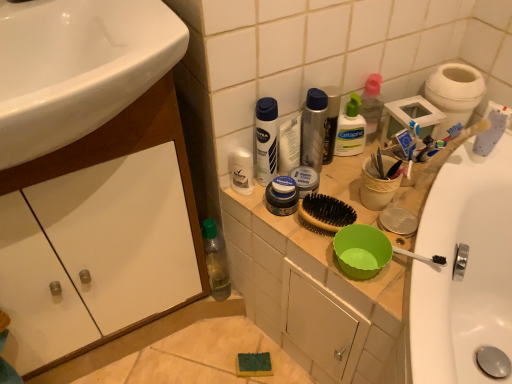
Describe the element at coordinates (314, 295) in the screenshot. This screenshot has width=512, height=384. I see `matte plastic toiletries at upper right` at that location.

This screenshot has height=384, width=512. Describe the element at coordinates (350, 129) in the screenshot. I see `clear plastic bottle at upper center, which is the first toiletry from right to left` at that location.

What is the approximate width of white glossy cabinet at lower left?

white glossy cabinet at lower left is 14.47 inches in width.

The width and height of the screenshot is (512, 384). I want to click on matte plastic toiletries at upper right, so click(x=314, y=295).

Does white glossy cabinet at lower left appear on the right side of translucent plastic mouthwash at center, the first mouthwash positioned from the right?

In fact, white glossy cabinet at lower left is to the left of translucent plastic mouthwash at center, the first mouthwash positioned from the right.

Does point (191, 197) lie in front of point (334, 97)?

Yes, point (191, 197) is closer to viewer.

Which object is thinner, white glossy cabinet at lower left or translucent plastic mouthwash at center, the first mouthwash positioned from the right?

With smaller width is translucent plastic mouthwash at center, the first mouthwash positioned from the right.

From the image's perspective, which one is positioned higher, clear plastic bottle at upper center, the fourth toiletry viewed from the left, or white glossy deodorant at center, the 4th toiletry from the right?

clear plastic bottle at upper center, the fourth toiletry viewed from the left, is shown above in the image.

How much distance is there between clear plastic bottle at upper center, which is the first toiletry from right to left, and white glossy deodorant at center, which is counted as the 1th toiletry, starting from the left?

They are 9.97 inches apart.

Does clear plastic bottle at upper center, which is the first toiletry from right to left, turn towards white glossy deodorant at center, the 4th toiletry from the right?

No, clear plastic bottle at upper center, which is the first toiletry from right to left, is not aimed at white glossy deodorant at center, the 4th toiletry from the right.

Is translucent plastic mouthwash at center, the first mouthwash positioned from the right, not near white glossy sink at left?

No, translucent plastic mouthwash at center, the first mouthwash positioned from the right, is in close proximity to white glossy sink at left.

Can you confirm if translucent plastic mouthwash at center, which is the 2th mouthwash from left to right, is wider than white glossy sink at left?

Incorrect, the width of translucent plastic mouthwash at center, which is the 2th mouthwash from left to right, does not surpass that of white glossy sink at left.

From the image's perspective, starting from the white glossy sink at left, which mouthwash is the 1st one below? Please provide its 2D coordinates.

[(331, 122)]

From a real-world perspective, which toiletry is the 3rd one above the white glossy cabinet at lower left? Please provide its 2D coordinates.

[(350, 129)]

Is white glossy cabinet at lower left behind clear plastic bottle at upper center, the fourth toiletry viewed from the left?

No.

From a real-world perspective, which is physically above, white glossy cabinet at lower left or clear plastic bottle at upper center, which is the first toiletry from right to left?

clear plastic bottle at upper center, which is the first toiletry from right to left, is physically above.

Does point (130, 116) appear closer or farther from the camera than point (347, 139)?

Point (130, 116) appears to be closer to the viewer than point (347, 139).

Is white glossy cabinet at lower left completely or partially outside of white glossy deodorant at center, the 4th toiletry from the right?

That's correct, white glossy cabinet at lower left is outside of white glossy deodorant at center, the 4th toiletry from the right.

Could you tell me if white glossy cabinet at lower left is facing white glossy deodorant at center, which is counted as the 1th toiletry, starting from the left?

No, white glossy cabinet at lower left does not turn towards white glossy deodorant at center, which is counted as the 1th toiletry, starting from the left.

Is white glossy cabinet at lower left not close to white glossy deodorant at center, which is counted as the 1th toiletry, starting from the left?

white glossy cabinet at lower left is near white glossy deodorant at center, which is counted as the 1th toiletry, starting from the left, not far away.

You are a GUI agent. You are given a task and a screenshot of the screen. Output one action in this format:
    pyautogui.click(x=<x>, y=<y>)
    Task: Click on the bathroom cabinet located in front of the white glossy deodorant at center, which is counted as the 1th toiletry, starting from the left
    The height and width of the screenshot is (384, 512).
    Given the screenshot: What is the action you would take?
    pyautogui.click(x=124, y=155)

Looking at their sizes, would you say white glossy cabinet at lower left is wider or thinner than matte silver container at center, acting as the second toiletry starting from the left?

white glossy cabinet at lower left is wider than matte silver container at center, acting as the second toiletry starting from the left.

Which object is closer to the camera, white glossy cabinet at lower left or matte silver container at center, acting as the second toiletry starting from the left?

white glossy cabinet at lower left.

Consider the image. From the image's perspective, would you say white glossy cabinet at lower left is shown under matte silver container at center, acting as the second toiletry starting from the left?

Correct, white glossy cabinet at lower left appears lower than matte silver container at center, acting as the second toiletry starting from the left, in the image.

Is white glossy cabinet at lower left oriented towards matte silver container at center, acting as the second toiletry starting from the left?

No, white glossy cabinet at lower left is not turned towards matte silver container at center, acting as the second toiletry starting from the left.

At what (x,y) coordinates should I click in order to perform the action: click on bathroom cabinet that is on the left side of matte silver container at center, which is the third toiletry in right-to-left order. Please return your answer as a coordinate pair (x, y). This screenshot has height=384, width=512. Looking at the image, I should click on (124, 155).

Can white glossy cabinet at lower left be found inside matte silver container at center, which is the third toiletry in right-to-left order?

No.

How different are the orientations of matte silver container at center, acting as the second toiletry starting from the left, and white glossy cabinet at lower left in degrees?

There is a 1.49-degree angle between the facing directions of matte silver container at center, acting as the second toiletry starting from the left, and white glossy cabinet at lower left.

Where is `bathroom cabinet below the translucent plastic mouthwash at center, which is the 2th mouthwash from left to right (from a real-world perspective)`? Image resolution: width=512 pixels, height=384 pixels. bathroom cabinet below the translucent plastic mouthwash at center, which is the 2th mouthwash from left to right (from a real-world perspective) is located at coordinates (124, 155).

This screenshot has width=512, height=384. In order to click on the 2nd toiletry positioned above the white glossy deodorant at center, which is counted as the 1th toiletry, starting from the left (from the image's perspective) in this screenshot , I will do `click(350, 129)`.

Which object lies further to the anchor point matte plastic toiletries at upper right, metallic silver deodorant at upper center, acting as the 2th toiletry starting from the right, or white matte nivea spray can at center, the 1th mouthwash viewed from the left?

white matte nivea spray can at center, the 1th mouthwash viewed from the left, lies further to matte plastic toiletries at upper right than the other object.

When comparing their distances from white matte nivea spray can at center, the second mouthwash in the right-to-left sequence, does translucent plastic mouthwash at center, which is the 2th mouthwash from left to right, or white glossy sink at left seem closer?

Based on the image, translucent plastic mouthwash at center, which is the 2th mouthwash from left to right, appears to be nearer to white matte nivea spray can at center, the second mouthwash in the right-to-left sequence.

Looking at the image, which one is located further to white glossy deodorant at center, the 4th toiletry from the right, matte plastic toiletries at upper right or clear plastic bottle at upper center, which is the first toiletry from right to left?

matte plastic toiletries at upper right lies further to white glossy deodorant at center, the 4th toiletry from the right, than the other object.

Looking at the image, which one is located closer to metallic silver deodorant at upper center, acting as the 2th toiletry starting from the right, white glossy sink at left or white glossy deodorant at center, the 4th toiletry from the right?

white glossy deodorant at center, the 4th toiletry from the right.

Which object lies nearer to the anchor point white glossy deodorant at center, the 4th toiletry from the right, matte silver container at center, acting as the second toiletry starting from the left, or metallic silver deodorant at upper center, acting as the 2th toiletry starting from the right?

matte silver container at center, acting as the second toiletry starting from the left.

Looking at the image, which one is located further to translucent plastic mouthwash at center, which is the 2th mouthwash from left to right, green plastic bottle at lower left or white matte nivea spray can at center, the second mouthwash in the right-to-left sequence?

green plastic bottle at lower left is positioned further to the anchor translucent plastic mouthwash at center, which is the 2th mouthwash from left to right.

Which object lies nearer to the anchor point white glossy cabinet at lower left, matte plastic toiletries at upper right or white glossy deodorant at center, which is counted as the 1th toiletry, starting from the left?

white glossy deodorant at center, which is counted as the 1th toiletry, starting from the left, lies closer to white glossy cabinet at lower left than the other object.

From the image, which object appears to be farther from matte plastic toiletries at upper right, white glossy cabinet at lower left or metallic silver deodorant at upper center, acting as the 2th toiletry starting from the right?

Among the two, white glossy cabinet at lower left is located further to matte plastic toiletries at upper right.

Where is `mouthwash between metallic silver deodorant at upper center, the 3th toiletry viewed from the left, and green plastic bottle at lower left from top to bottom`? The image size is (512, 384). mouthwash between metallic silver deodorant at upper center, the 3th toiletry viewed from the left, and green plastic bottle at lower left from top to bottom is located at coordinates (266, 140).

Find the location of a particular element. mouthwash situated between metallic silver deodorant at upper center, acting as the 2th toiletry starting from the right, and clear plastic bottle at upper center, which is the first toiletry from right to left, from left to right is located at coordinates (331, 122).

Find the location of `bottle between white glossy sink at left and matte plastic toiletries at upper right`. bottle between white glossy sink at left and matte plastic toiletries at upper right is located at coordinates (216, 261).

Locate an element on the screen. This screenshot has width=512, height=384. bottle between white glossy cabinet at lower left and translucent plastic mouthwash at center, which is the 2th mouthwash from left to right, in the horizontal direction is located at coordinates (216, 261).